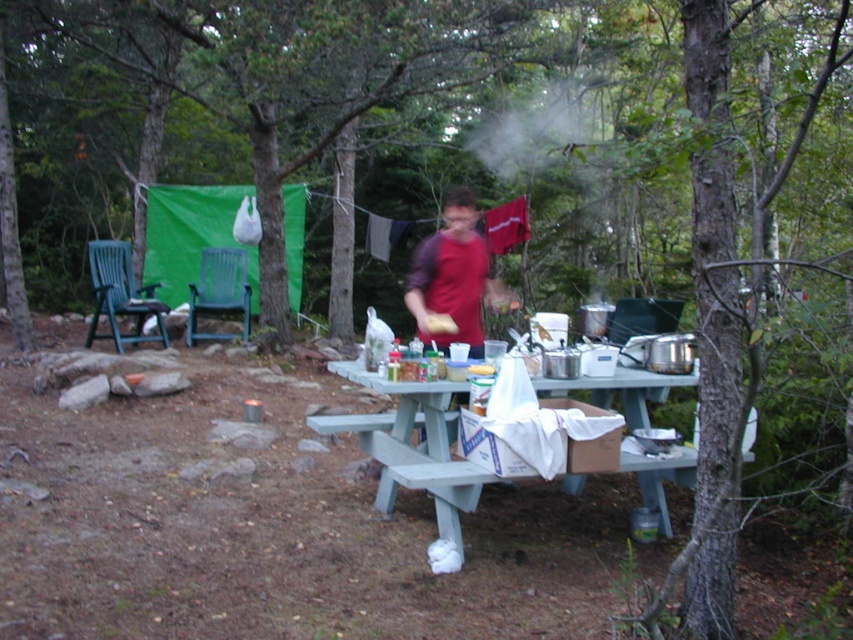
Question: Can you confirm if green painted wood picnic table at center is positioned to the right of matte red shirt at center?

Choices:
 (A) yes
 (B) no

Answer: (B)

Question: Among these objects, which one is farthest from the camera?

Choices:
 (A) green painted wood picnic table at center
 (B) matte red shirt at center

Answer: (B)

Question: Which point is closer to the camera?

Choices:
 (A) [x=434, y=461]
 (B) [x=445, y=305]

Answer: (A)

Question: Does green painted wood picnic table at center appear over matte red shirt at center?

Choices:
 (A) yes
 (B) no

Answer: (B)

Question: Can you confirm if green painted wood picnic table at center is positioned to the right of matte red shirt at center?

Choices:
 (A) no
 (B) yes

Answer: (A)